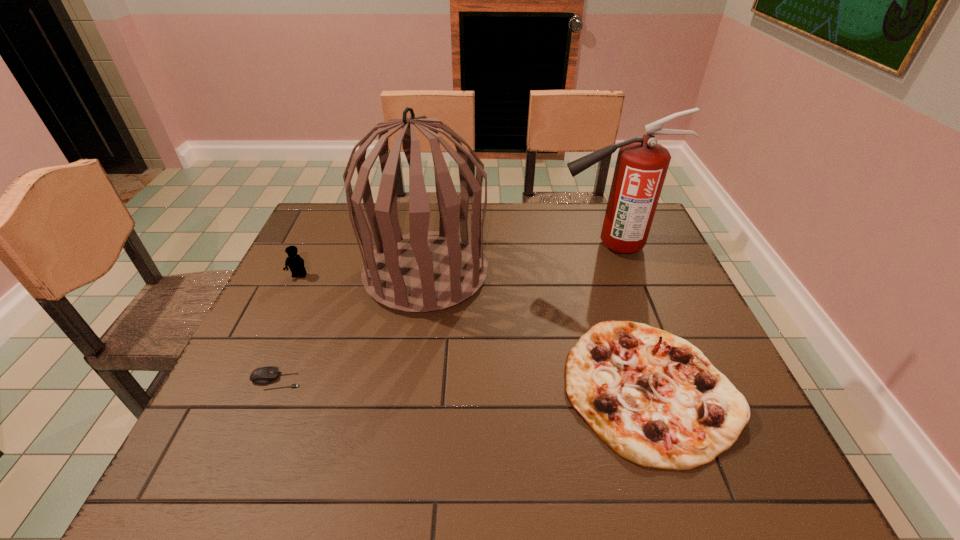
This screenshot has width=960, height=540. What are the coordinates of `the third object from right to left` in the screenshot? It's located at (423, 271).

You are a GUI agent. You are given a task and a screenshot of the screen. Output one action in this format:
    pyautogui.click(x=<x>, y=<y>)
    Task: Click on the fire extinguisher
    The width and height of the screenshot is (960, 540).
    Given the screenshot: What is the action you would take?
    pyautogui.click(x=642, y=164)

The height and width of the screenshot is (540, 960). I want to click on Lego, so click(x=295, y=263).

Where is `the second shortest object`? Image resolution: width=960 pixels, height=540 pixels. the second shortest object is located at coordinates (653, 398).

The image size is (960, 540). I want to click on mouse, so (x=265, y=375).

This screenshot has height=540, width=960. What are the coordinates of `vacant position located 0.320m on the right of the third object from right to left` in the screenshot? It's located at (600, 273).

Find the location of a particular element. The width and height of the screenshot is (960, 540). blank area located at the nozzle of the fire extinguisher is located at coordinates (455, 246).

At what (x,y) coordinates should I click in order to perform the action: click on vacant space located at the nozzle of the fire extinguisher. Please return your answer as a coordinate pair (x, y). Image resolution: width=960 pixels, height=540 pixels. Looking at the image, I should click on (501, 246).

At what (x,y) coordinates should I click in order to perform the action: click on free location located at the nozzle of the fire extinguisher. Please return your answer as a coordinate pair (x, y). The image size is (960, 540). Looking at the image, I should click on coord(462,246).

Find the location of `free space located on the front-facing side of the third shortest object`. free space located on the front-facing side of the third shortest object is located at coordinates (256, 367).